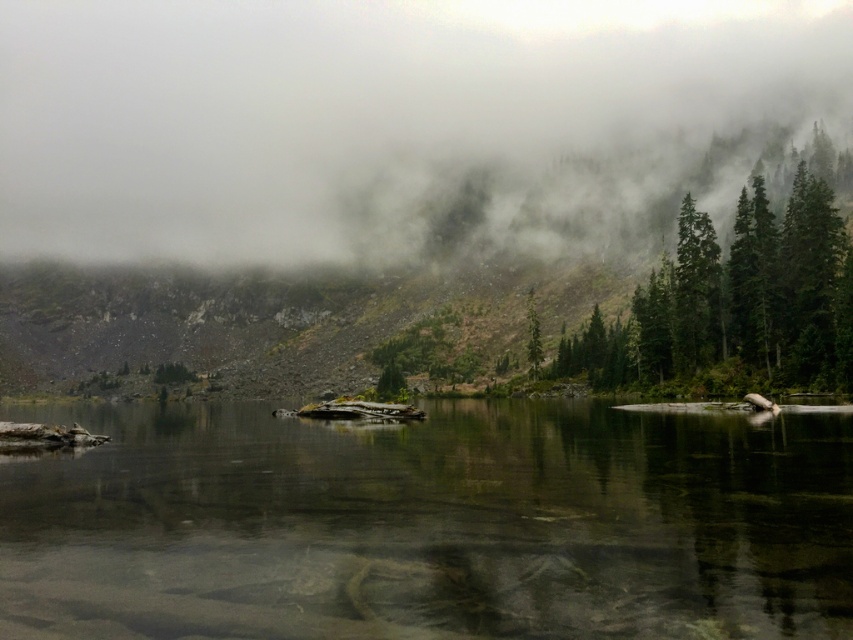
Between clear water at center and green matte tree at center, which one is positioned lower?

clear water at center is below.

Is clear water at center above green matte tree at center?

Incorrect, clear water at center is not positioned above green matte tree at center.

Is point (440, 564) positioned behind point (527, 304)?

No, (440, 564) is in front of (527, 304).

This screenshot has height=640, width=853. In order to click on clear water at center in this screenshot , I will do `click(430, 524)`.

Between foggy misty forest at upper center and green matte tree at center, which one appears on the left side from the viewer's perspective?

Positioned to the left is foggy misty forest at upper center.

Can you confirm if foggy misty forest at upper center is positioned to the left of green matte tree at center?

Indeed, foggy misty forest at upper center is positioned on the left side of green matte tree at center.

Identify the location of foggy misty forest at upper center. (373, 115).

Does point (700, 224) lie behind point (532, 336)?

No, it is in front of (532, 336).

Does green matte trees at right come behind green matte tree at center?

That is False.

What do you see at coordinates (735, 300) in the screenshot?
I see `green matte trees at right` at bounding box center [735, 300].

Locate an element on the screen. The height and width of the screenshot is (640, 853). green matte trees at right is located at coordinates (735, 300).